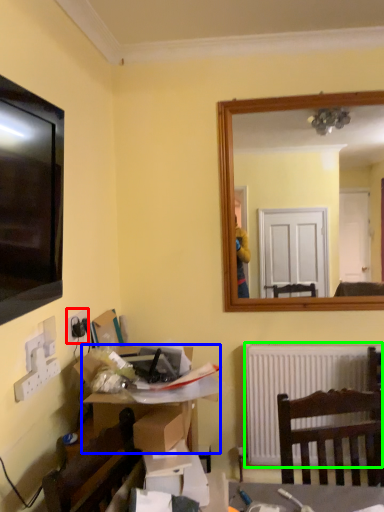
Question: Based on their relative distances, which object is nearer to electric outlet (highlighted by a red box)? Choose from desk (highlighted by a blue box) and radiator (highlighted by a green box).

Choices:
 (A) desk
 (B) radiator

Answer: (A)